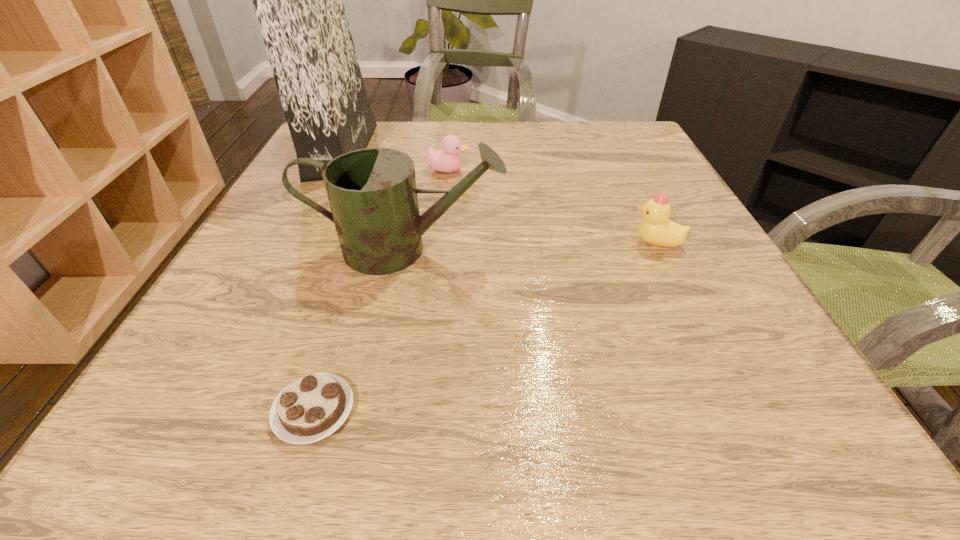
Locate an element on the screen. free space located 0.120m on the front-facing side of the right duckling is located at coordinates (565, 242).

Find the location of a particular element. blank area located 0.070m on the front-facing side of the right duckling is located at coordinates 593,242.

This screenshot has height=540, width=960. I want to click on free space located 0.150m on the front-facing side of the farther duckling, so click(x=535, y=170).

The height and width of the screenshot is (540, 960). Find the location of `free space located on the back of the nearest object`. free space located on the back of the nearest object is located at coordinates (366, 244).

Locate an element on the screen. The image size is (960, 540). shopping bag present at the far edge is located at coordinates (298, 0).

At what (x,y) coordinates should I click in order to perform the action: click on duckling located at the far edge. Please return your answer as a coordinate pair (x, y). Image resolution: width=960 pixels, height=540 pixels. Looking at the image, I should click on (448, 160).

The height and width of the screenshot is (540, 960). I want to click on object that is positioned at the near edge, so point(309,409).

Find the location of a particular element. shopping bag present at the left edge is located at coordinates (298, 0).

Identify the location of watering can situated at the left edge. (372, 192).

You are a GUI agent. You are given a task and a screenshot of the screen. Output one action in this format:
    pyautogui.click(x=<x>, y=<y>)
    Task: Click on the object at the right edge
    
    Given the screenshot: What is the action you would take?
    pyautogui.click(x=656, y=229)